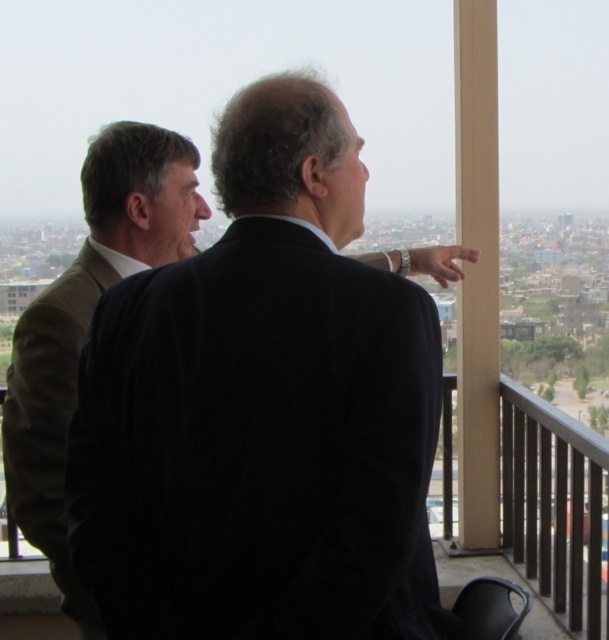
From the picture: Can you confirm if black matte suit at upper center is bigger than brown woolen suit at left?

Actually, black matte suit at upper center might be smaller than brown woolen suit at left.

Does black matte suit at upper center have a greater width compared to brown woolen suit at left?

Yes, black matte suit at upper center is wider than brown woolen suit at left.

Which is behind, point (155, 547) or point (82, 164)?

The point (82, 164) is behind.

I want to click on black matte suit at upper center, so click(x=258, y=445).